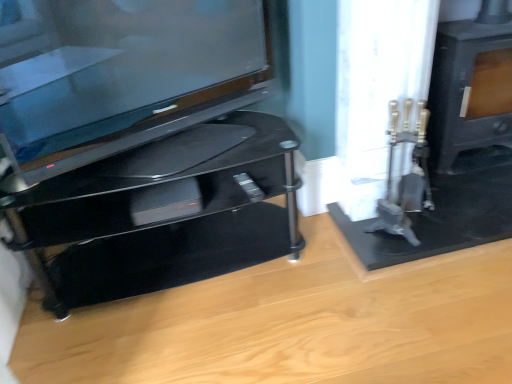
Question: From the image's perspective, is black glossy tv stand at left below glossy black tv at left?

Choices:
 (A) no
 (B) yes

Answer: (B)

Question: Considering the relative sizes of black glossy tv stand at left and glossy black tv at left in the image provided, is black glossy tv stand at left shorter than glossy black tv at left?

Choices:
 (A) yes
 (B) no

Answer: (A)

Question: Is black glossy tv stand at left at the right side of glossy black tv at left?

Choices:
 (A) yes
 (B) no

Answer: (B)

Question: Can you confirm if black glossy tv stand at left is bigger than glossy black tv at left?

Choices:
 (A) yes
 (B) no

Answer: (A)

Question: Does black glossy tv stand at left lie in front of glossy black tv at left?

Choices:
 (A) no
 (B) yes

Answer: (A)

Question: From a real-world perspective, is matte black stove at right positioned above or below black glossy tv stand at left?

Choices:
 (A) above
 (B) below

Answer: (A)

Question: Is point pyautogui.click(x=482, y=59) closer or farther from the camera than point pyautogui.click(x=231, y=155)?

Choices:
 (A) farther
 (B) closer

Answer: (A)

Question: Is matte black stove at right inside or outside of black glossy tv stand at left?

Choices:
 (A) inside
 (B) outside

Answer: (B)

Question: Looking at the image, does matte black stove at right seem bigger or smaller compared to black glossy tv stand at left?

Choices:
 (A) big
 (B) small

Answer: (B)

Question: From a real-world perspective, relative to matte black stove at right, is glossy black tv at left vertically above or below?

Choices:
 (A) below
 (B) above

Answer: (B)

Question: Based on their sizes in the image, would you say glossy black tv at left is bigger or smaller than matte black stove at right?

Choices:
 (A) small
 (B) big

Answer: (A)

Question: Considering their positions, is glossy black tv at left located in front of or behind matte black stove at right?

Choices:
 (A) behind
 (B) front

Answer: (B)

Question: From their relative heights in the image, would you say glossy black tv at left is taller or shorter than matte black stove at right?

Choices:
 (A) short
 (B) tall

Answer: (A)

Question: Considering the positions of black glossy tv stand at left and matte black stove at right in the image, is black glossy tv stand at left taller or shorter than matte black stove at right?

Choices:
 (A) short
 (B) tall

Answer: (A)

Question: Looking at their shapes, would you say black glossy tv stand at left is wider or thinner than matte black stove at right?

Choices:
 (A) thin
 (B) wide

Answer: (B)